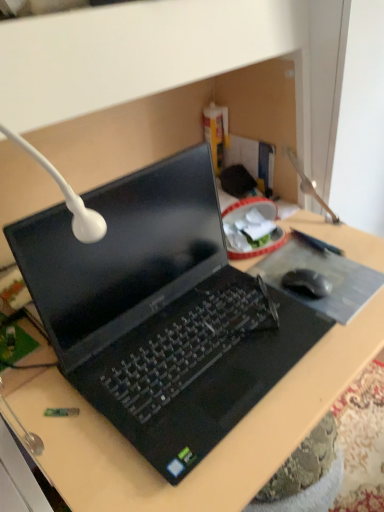
The height and width of the screenshot is (512, 384). I want to click on black matte mousepad at center, so click(x=324, y=276).

Describe the element at coordinates (211, 451) in the screenshot. I see `black plastic laptop at center` at that location.

Where is `black matte mousepad at center`? The height and width of the screenshot is (512, 384). black matte mousepad at center is located at coordinates (324, 276).

Considering the positions of objects black matte mousepad at center and black rubber mouse at right in the image provided, who is in front, black matte mousepad at center or black rubber mouse at right?

black matte mousepad at center is in front.

In the image, there is a black rubber mouse at right. Where is `mousepad above it (from the image's perspective)`? Image resolution: width=384 pixels, height=512 pixels. mousepad above it (from the image's perspective) is located at coordinates (324, 276).

Which is farther from the camera, (291, 238) or (307, 290)?

The point (291, 238) is farther from the camera.

How many degrees apart are the facing directions of black matte mousepad at center and black plastic laptop at center?

0.701 degrees.

From a real-world perspective, is black matte mousepad at center positioned over black plastic laptop at center based on gravity?

No, from a real-world perspective, black matte mousepad at center is not above black plastic laptop at center.

Which is behind, black matte mousepad at center or black plastic laptop at center?

black matte mousepad at center.

Is black matte mousepad at center aimed at black plastic laptop at center?

No, black matte mousepad at center is not oriented towards black plastic laptop at center.

In terms of width, does black rubber mouse at right look wider or thinner when compared to black matte mousepad at center?

black rubber mouse at right is thinner than black matte mousepad at center.

Considering the relative positions of black rubber mouse at right and black matte mousepad at center in the image provided, is black rubber mouse at right to the left or to the right of black matte mousepad at center?

Based on their positions, black rubber mouse at right is located to the left of black matte mousepad at center.

How many degrees apart are the facing directions of black rubber mouse at right and black matte mousepad at center?

The angular difference between black rubber mouse at right and black matte mousepad at center is 6.13 degrees.

Relative to black matte mousepad at center, is black rubber mouse at right in front or behind?

Visually, black rubber mouse at right is located behind black matte mousepad at center.

Looking at this image, is black plastic laptop at center aimed at black rubber mouse at right?

No, black plastic laptop at center is not oriented towards black rubber mouse at right.

Can you confirm if black plastic laptop at center is bigger than black rubber mouse at right?

Yes, black plastic laptop at center is bigger than black rubber mouse at right.

Which is in front, black plastic laptop at center or black rubber mouse at right?

black plastic laptop at center is in front.

How many degrees apart are the facing directions of black plastic laptop at center and black rubber mouse at right?

black plastic laptop at center and black rubber mouse at right are facing 5.43 degrees away from each other.

Looking at this image, considering the positions of objects black plastic laptop at center and black matte mousepad at center in the image provided, who is more to the left, black plastic laptop at center or black matte mousepad at center?

black plastic laptop at center is more to the left.

Consider the image. Are black plastic laptop at center and black matte mousepad at center far apart?

black plastic laptop at center is actually quite close to black matte mousepad at center.

Between black plastic laptop at center and black matte mousepad at center, which one has larger size?

Bigger between the two is black plastic laptop at center.

Which object is positioned more to the left, black rubber mouse at right or black plastic laptop at center?

From the viewer's perspective, black plastic laptop at center appears more on the left side.

Locate an element on the screen. The height and width of the screenshot is (512, 384). mouse located on the right of black plastic laptop at center is located at coordinates (307, 283).

From a real-world perspective, is black rubber mouse at right under black plastic laptop at center?

Yes.

Is black rubber mouse at right oriented towards black plastic laptop at center?

No, black rubber mouse at right is not turned towards black plastic laptop at center.

This screenshot has width=384, height=512. In order to click on mousepad above the black rubber mouse at right (from the image's perspective) in this screenshot , I will do `click(324, 276)`.

The image size is (384, 512). Find the location of `mousepad below the black plastic laptop at center (from a real-world perspective)`. mousepad below the black plastic laptop at center (from a real-world perspective) is located at coordinates (324, 276).

Which object lies further to the anchor point black plastic laptop at center, black matte mousepad at center or black rubber mouse at right?

black rubber mouse at right.

From the image, which object appears to be nearer to black rubber mouse at right, black plastic laptop at center or black matte mousepad at center?

The object closer to black rubber mouse at right is black matte mousepad at center.

When comparing their distances from black matte mousepad at center, does black rubber mouse at right or black plastic laptop at center seem closer?

black rubber mouse at right lies closer to black matte mousepad at center than the other object.

When comparing their distances from black matte mousepad at center, does black plastic laptop at center or black rubber mouse at right seem further?

black plastic laptop at center.

Based on their spatial positions, is black matte mousepad at center or black plastic laptop at center closer to black rubber mouse at right?

black matte mousepad at center.

When comparing their distances from black plastic laptop at center, does black rubber mouse at right or black matte mousepad at center seem further?

black rubber mouse at right is further to black plastic laptop at center.

Find the location of a particular element. mousepad between black plastic laptop at center and black rubber mouse at right along the z-axis is located at coordinates (324, 276).